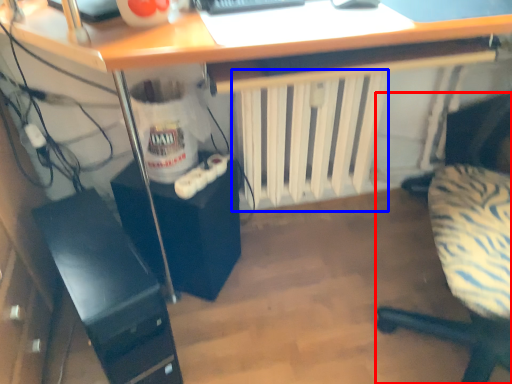
Question: Which of the following is the closest to the observer, chair (highlighted by a red box) or radiator (highlighted by a blue box)?

Choices:
 (A) chair
 (B) radiator

Answer: (A)